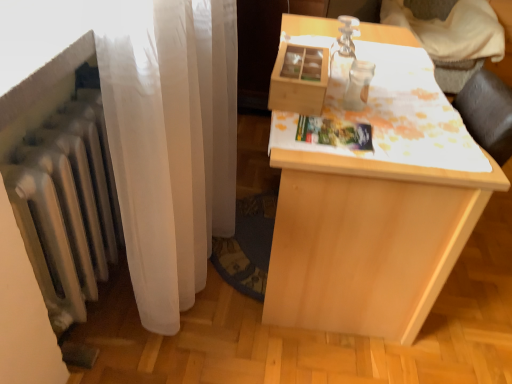
Question: Choose the correct answer: Is white sheer curtain at left inside light wood table at center or outside it?

Choices:
 (A) outside
 (B) inside

Answer: (A)

Question: Considering the positions of white sheer curtain at left and light wood table at center in the image, is white sheer curtain at left wider or thinner than light wood table at center?

Choices:
 (A) wide
 (B) thin

Answer: (B)

Question: Considering the real-world distances, which object is closest to the light wood table at center?

Choices:
 (A) white sheer curtain at left
 (B) wooden table at upper right

Answer: (A)

Question: Estimate the real-world distances between objects in this image. Which object is closer to the wooden table at upper right?

Choices:
 (A) white sheer curtain at left
 (B) light wood table at center

Answer: (B)